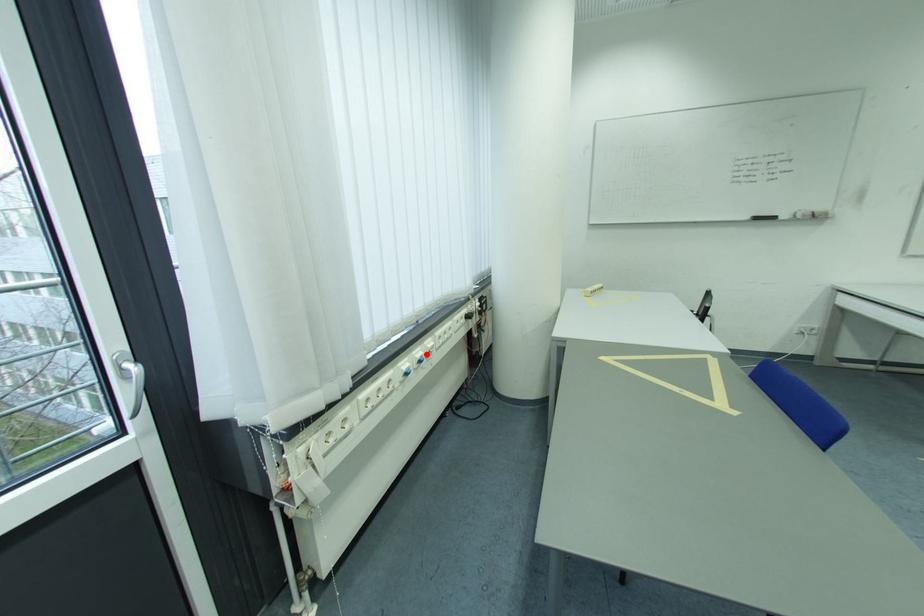
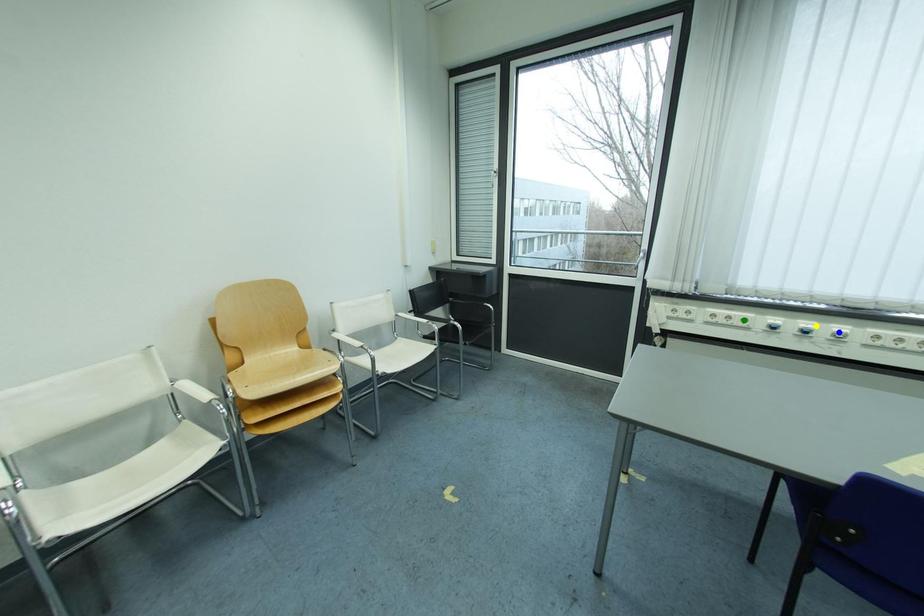
Question: I am providing you with two images of the same scene from different viewpoints. A red point is marked on the first image. You are given multiple points on the second image. Which mark in image 2 goes with the point in image 1?

Choices:
 (A) blue point
 (B) green point
 (C) yellow point

Answer: (C)